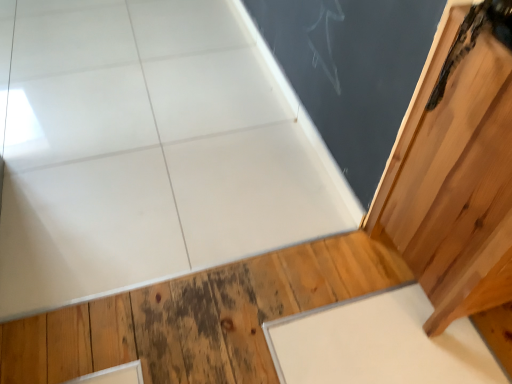
What do you see at coordinates (351, 71) in the screenshot? I see `matte black chalkboard at upper right` at bounding box center [351, 71].

The image size is (512, 384). I want to click on matte black chalkboard at upper right, so click(351, 71).

Where is `white matte slate at lower right`? white matte slate at lower right is located at coordinates (378, 343).

The width and height of the screenshot is (512, 384). In order to click on matte black chalkboard at upper right in this screenshot , I will do `click(351, 71)`.

Looking at this image, is wooden door at upper right bigger than matte black chalkboard at upper right?

Indeed, wooden door at upper right has a larger size compared to matte black chalkboard at upper right.

In the image, is wooden door at upper right on the left side or the right side of matte black chalkboard at upper right?

In the image, wooden door at upper right appears on the right side of matte black chalkboard at upper right.

Are wooden door at upper right and matte black chalkboard at upper right beside each other?

No, wooden door at upper right is not in contact with matte black chalkboard at upper right.

Where is `bulletin board lying behind the wooden door at upper right`? The width and height of the screenshot is (512, 384). bulletin board lying behind the wooden door at upper right is located at coordinates (351, 71).

Is wooden door at upper right at the right side of natural wood floor at lower right?

Yes, wooden door at upper right is to the right of natural wood floor at lower right.

Does wooden door at upper right have a lesser height compared to natural wood floor at lower right?

In fact, wooden door at upper right may be taller than natural wood floor at lower right.

From the image's perspective, is wooden door at upper right above or below natural wood floor at lower right?

From the image's perspective, wooden door at upper right appears above natural wood floor at lower right.

Is matte black chalkboard at upper right completely or partially outside of wooden door at upper right?

Yes.

From the image's perspective, is matte black chalkboard at upper right on wooden door at upper right?

Indeed, from the image's perspective, matte black chalkboard at upper right is shown above wooden door at upper right.

From a real-world perspective, is matte black chalkboard at upper right located beneath wooden door at upper right?

Correct, in the physical world, matte black chalkboard at upper right is lower than wooden door at upper right.

Which of these two, natural wood floor at lower right or white matte slate at lower right, stands shorter?

natural wood floor at lower right is shorter.

Does natural wood floor at lower right lie behind white matte slate at lower right?

No, natural wood floor at lower right is closer to the camera.

From a real-world perspective, which is physically above, natural wood floor at lower right or white matte slate at lower right?

From a 3D spatial view, white matte slate at lower right is above.

Does natural wood floor at lower right appear on the right side of white matte slate at lower right?

No, natural wood floor at lower right is not to the right of white matte slate at lower right.

Between white matte slate at lower right and natural wood floor at lower right, which one has less height?

natural wood floor at lower right.

This screenshot has width=512, height=384. I want to click on hardwood in front of the white matte slate at lower right, so click(x=199, y=317).

Does white matte slate at lower right have a smaller size compared to natural wood floor at lower right?

Yes, white matte slate at lower right is smaller than natural wood floor at lower right.

Does white matte slate at lower right contain natural wood floor at lower right?

No, natural wood floor at lower right is not a part of white matte slate at lower right.

Does point (190, 298) lie behind point (365, 177)?

No, it is in front of (365, 177).

Is matte black chalkboard at upper right surrounded by natural wood floor at lower right?

Definitely not — matte black chalkboard at upper right is not inside natural wood floor at lower right.

Does natural wood floor at lower right appear on the left side of matte black chalkboard at upper right?

Correct, you'll find natural wood floor at lower right to the left of matte black chalkboard at upper right.

Is natural wood floor at lower right touching matte black chalkboard at upper right?

natural wood floor at lower right and matte black chalkboard at upper right are clearly separated.

From the image's perspective, which one is positioned higher, matte black chalkboard at upper right or white matte slate at lower right?

From the image's view, matte black chalkboard at upper right is above.

Considering the sizes of objects matte black chalkboard at upper right and white matte slate at lower right in the image provided, who is taller, matte black chalkboard at upper right or white matte slate at lower right?

matte black chalkboard at upper right is taller.

Based on their sizes in the image, would you say matte black chalkboard at upper right is bigger or smaller than white matte slate at lower right?

Clearly, matte black chalkboard at upper right is larger in size than white matte slate at lower right.

From a real-world perspective, is matte black chalkboard at upper right physically below white matte slate at lower right?

No, from a real-world perspective, matte black chalkboard at upper right is not below white matte slate at lower right.

Image resolution: width=512 pixels, height=384 pixels. I want to click on bulletin board behind the wooden door at upper right, so click(x=351, y=71).

Locate an element on the screen. The height and width of the screenshot is (384, 512). door on the right of natural wood floor at lower right is located at coordinates (457, 172).

Based on their spatial positions, is white matte slate at lower right or wooden door at upper right closer to natural wood floor at lower right?

white matte slate at lower right.

Estimate the real-world distances between objects in this image. Which object is further from white matte slate at lower right, matte black chalkboard at upper right or natural wood floor at lower right?

matte black chalkboard at upper right.

Looking at the image, which one is located further to natural wood floor at lower right, wooden door at upper right or white matte slate at lower right?

The object further to natural wood floor at lower right is wooden door at upper right.

Based on their spatial positions, is natural wood floor at lower right or white matte slate at lower right further from wooden door at upper right?

Based on the image, natural wood floor at lower right appears to be further to wooden door at upper right.

From the image, which object appears to be nearer to white matte slate at lower right, wooden door at upper right or matte black chalkboard at upper right?

wooden door at upper right lies closer to white matte slate at lower right than the other object.

Based on their spatial positions, is matte black chalkboard at upper right or white matte slate at lower right closer to natural wood floor at lower right?

white matte slate at lower right is closer to natural wood floor at lower right.

From the image, which object appears to be farther from white matte slate at lower right, natural wood floor at lower right or matte black chalkboard at upper right?

matte black chalkboard at upper right lies further to white matte slate at lower right than the other object.

When comparing their distances from white matte slate at lower right, does matte black chalkboard at upper right or wooden door at upper right seem further?

Based on the image, matte black chalkboard at upper right appears to be further to white matte slate at lower right.

Identify the location of door between matte black chalkboard at upper right and natural wood floor at lower right in the up-down direction. The height and width of the screenshot is (384, 512). (457, 172).

Where is `door between matte black chalkboard at upper right and white matte slate at lower right vertically`? The width and height of the screenshot is (512, 384). door between matte black chalkboard at upper right and white matte slate at lower right vertically is located at coordinates (457, 172).

Where is `slate situated between natural wood floor at lower right and wooden door at upper right from left to right`? slate situated between natural wood floor at lower right and wooden door at upper right from left to right is located at coordinates (378, 343).

Identify the location of hardwood between matte black chalkboard at upper right and white matte slate at lower right in the vertical direction. (199, 317).